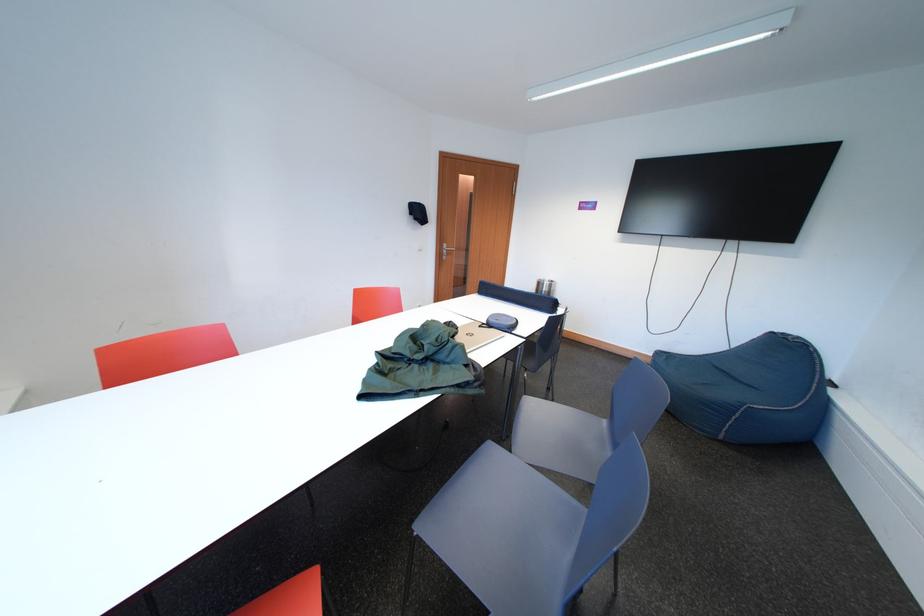
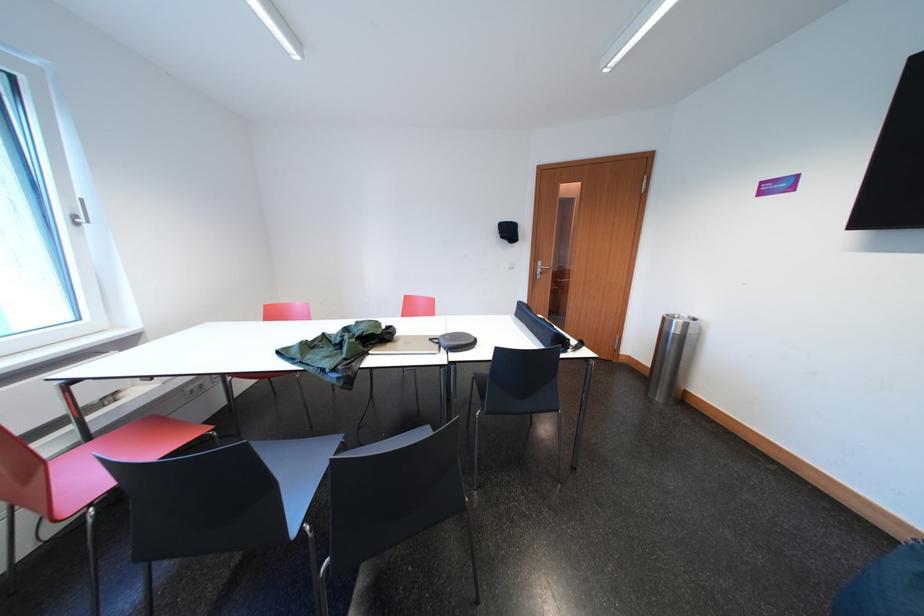
In the second image, find the point that corresponds to point 432,330 in the first image.

(367, 326)